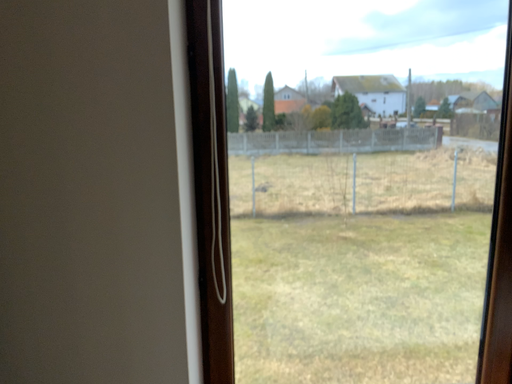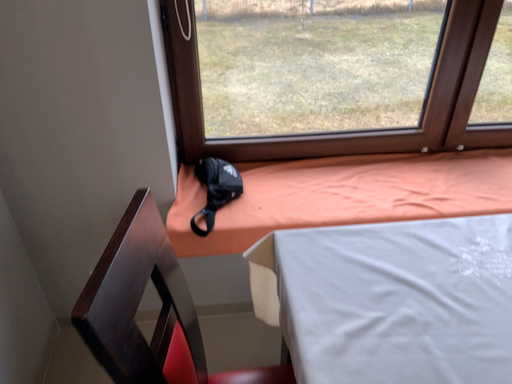
Question: How did the camera likely rotate when shooting the video?

Choices:
 (A) rotated right
 (B) rotated left

Answer: (A)